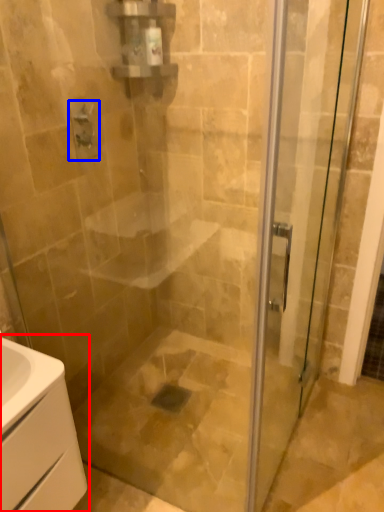
Question: Which object is further to the camera taking this photo, bathroom cabinet (highlighted by a red box) or shower (highlighted by a blue box)?

Choices:
 (A) bathroom cabinet
 (B) shower

Answer: (B)